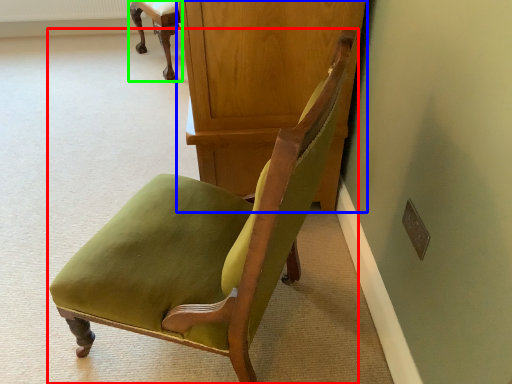
Question: Which is farther away from chair (highlighted by a red box)? dresser (highlighted by a blue box) or chair (highlighted by a green box)?

Choices:
 (A) dresser
 (B) chair

Answer: (B)